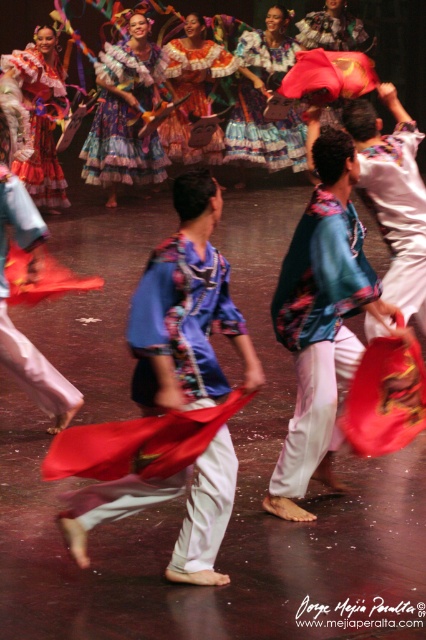
You are a stagehand trying to set up a spotlight for the performance. You need to determine which of the two points, point [393,236] or point [253,45], is closer to the audience. Which point should you choose to ensure the spotlight hits the performer nearest to the front?

Point [393,236] is in front of point [253,45], so you should choose point [393,236] to ensure the spotlight hits the performer nearest to the front.

You are a photographer standing at the back of the stage. You need to capture a photo where both the matte blue fabric at center and the silky blue blouse at center are visible. Based on their positions, which object should you ensure is not blocking the other?

The matte blue fabric at center is to the left of the silky blue blouse at center, so you should ensure that the silky blue blouse at center is not blocking the matte blue fabric at center.